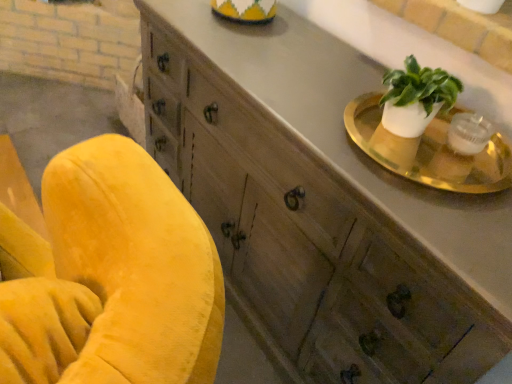
At what (x,y) coordinates should I click in order to perform the action: click on free region on the left part of gold metallic tray at upper right. Please return your answer as a coordinate pair (x, y). The height and width of the screenshot is (384, 512). Looking at the image, I should click on pos(313,110).